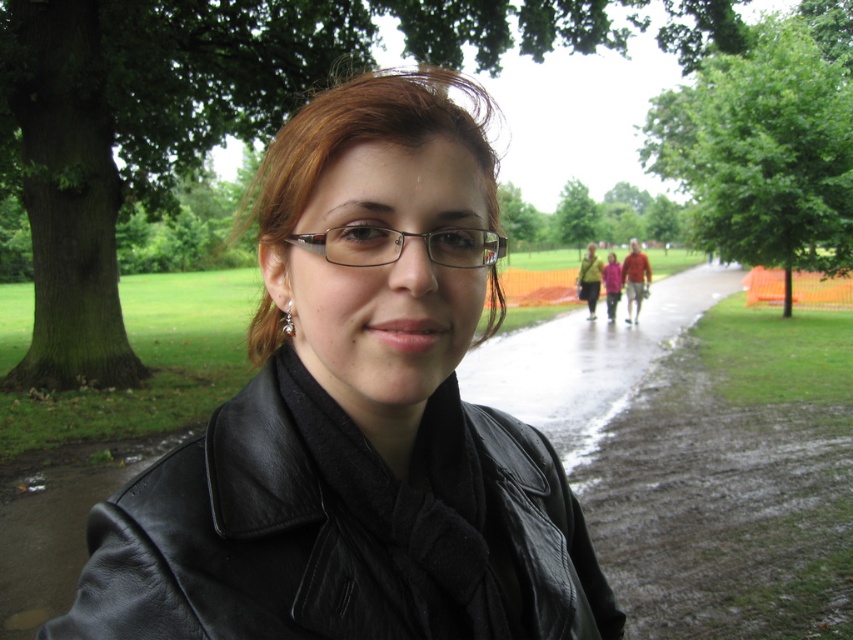
The image size is (853, 640). What do you see at coordinates (341, 531) in the screenshot?
I see `black leather jacket at center` at bounding box center [341, 531].

Is point (302, 401) positioned behind point (395, 237)?

Yes, point (302, 401) is behind point (395, 237).

Find the location of `black leather jacket at center`. black leather jacket at center is located at coordinates (341, 531).

Does matte black glasses at center have a lesser height compared to green leafy tree at center?

Yes.

Image resolution: width=853 pixels, height=640 pixels. Find the location of `matte black glasses at center`. matte black glasses at center is located at coordinates (402, 244).

Who is more forward, (436,257) or (567,179)?

Point (436,257) is in front.

Where is `matte black glasses at center`? The height and width of the screenshot is (640, 853). matte black glasses at center is located at coordinates (402, 244).

Is point (576, 227) farther from camera compared to point (595, 268)?

Yes.

Image resolution: width=853 pixels, height=640 pixels. Describe the element at coordinates (575, 214) in the screenshot. I see `green leafy tree at center` at that location.

The height and width of the screenshot is (640, 853). Identify the location of green leafy tree at center. (575, 214).